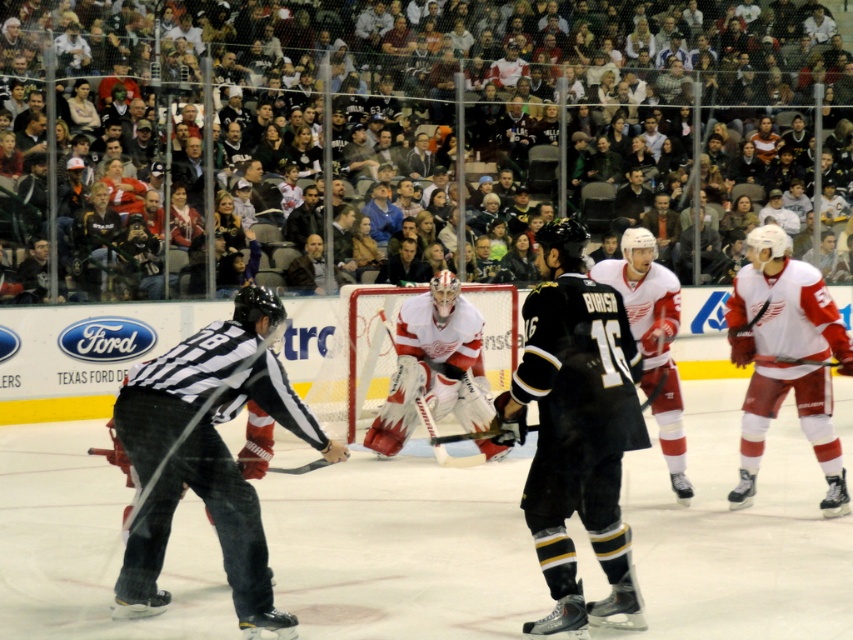
In the scene shown: Can you confirm if black jersey at center is positioned below red matte jersey at center?

Correct, black jersey at center is located below red matte jersey at center.

Can you confirm if black jersey at center is positioned to the right of red matte jersey at center?

Incorrect, black jersey at center is not on the right side of red matte jersey at center.

Is point (544, 577) positioned in front of point (647, 260)?

Yes.

At what (x,y) coordinates should I click in order to perform the action: click on black jersey at center. Please return your answer as a coordinate pair (x, y). This screenshot has height=640, width=853. Looking at the image, I should click on (576, 429).

Which is in front, point (612, 557) or point (294, 472)?

Positioned in front is point (612, 557).

From the picture: Is black jersey at center to the left of black matte hockey stick at center from the viewer's perspective?

In fact, black jersey at center is to the right of black matte hockey stick at center.

Is point (523, 509) closer to camera compared to point (241, 451)?

Yes, point (523, 509) is closer to viewer.

Identify the location of black jersey at center. This screenshot has height=640, width=853. tap(576, 429).

Is white jersey at center below white jersey at right?

Correct, white jersey at center is located below white jersey at right.

Does point (244, 349) come behind point (733, 291)?

That is False.

The width and height of the screenshot is (853, 640). Identify the location of white jersey at center. (209, 454).